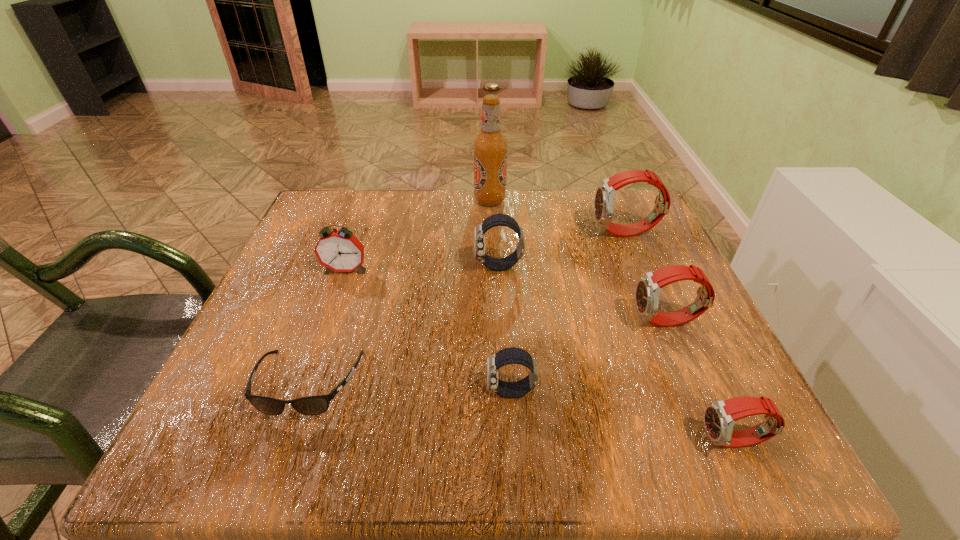
The image size is (960, 540). I want to click on vacant space located on the face of the second farthest object, so click(x=516, y=233).

Find the location of a particular element. vacant position located 0.360m on the face of the bigger dark watch is located at coordinates (302, 267).

At what (x,y) coordinates should I click in order to perform the action: click on vacant space situated on the face of the bigger dark watch. Please return your answer as a coordinate pair (x, y). The image size is (960, 540). Looking at the image, I should click on (431, 267).

The width and height of the screenshot is (960, 540). I want to click on free space located on the face of the bigger dark watch, so click(397, 267).

This screenshot has width=960, height=540. I want to click on free point located on the face of the second farthest red watch, so click(x=547, y=322).

Identify the location of vacant space located 0.140m on the face of the second farthest red watch. (558, 322).

Image resolution: width=960 pixels, height=540 pixels. What are the coordinates of `vacant space located on the face of the second farthest red watch` in the screenshot? It's located at (465, 322).

Where is `free region located on the clock face of the alarm clock`? free region located on the clock face of the alarm clock is located at coordinates (282, 447).

Where is `vacant space positioned on the face of the second nearest watch`? vacant space positioned on the face of the second nearest watch is located at coordinates (289, 392).

Identify the location of free space located on the face of the second nearest watch. (410, 392).